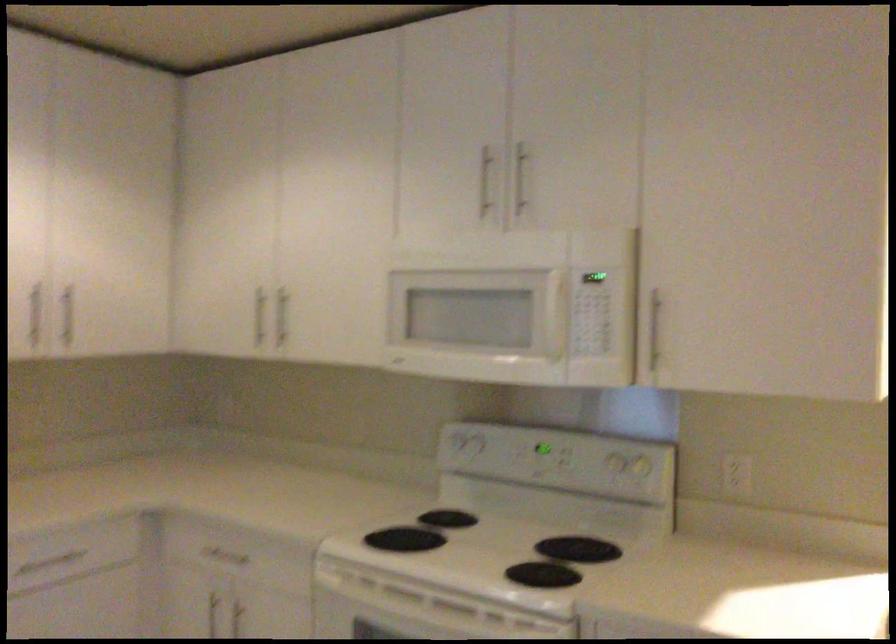
Identify the location of microwave keypad button. (591, 313).